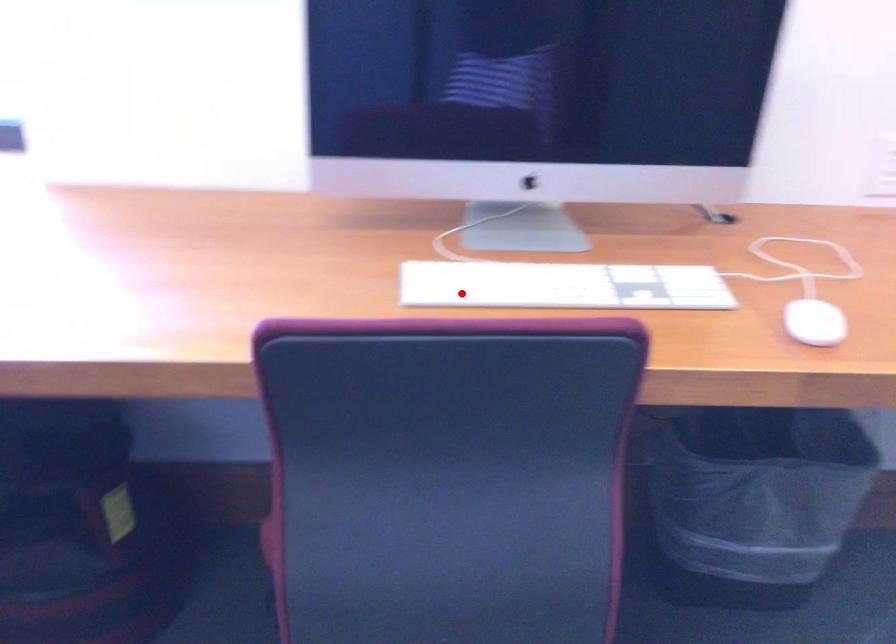
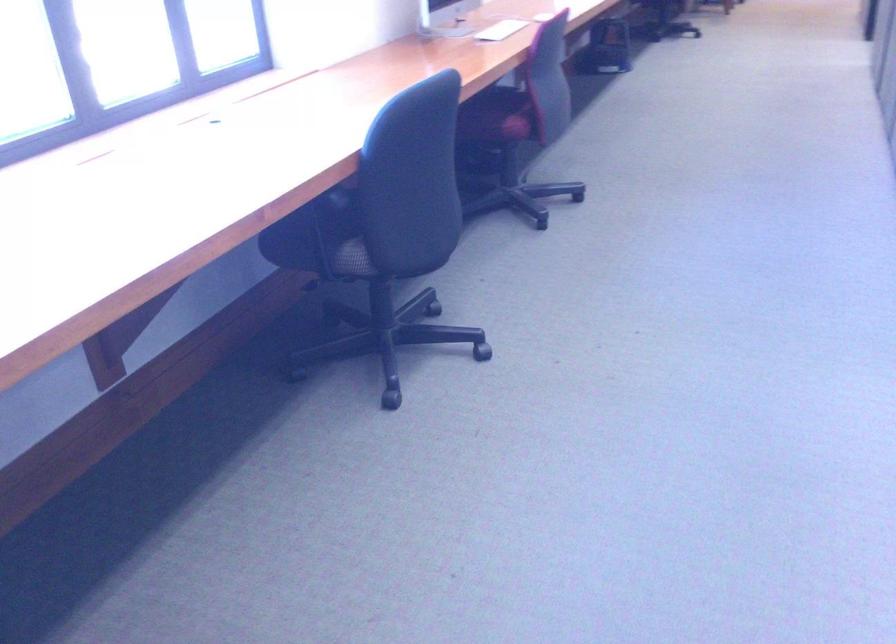
Question: I am providing you with two images of the same scene from different viewpoints. In image1, a red point is highlighted. Considering the same 3D point in image2, which of the following is correct?

Choices:
 (A) It is closer
 (B) It is farther

Answer: (B)